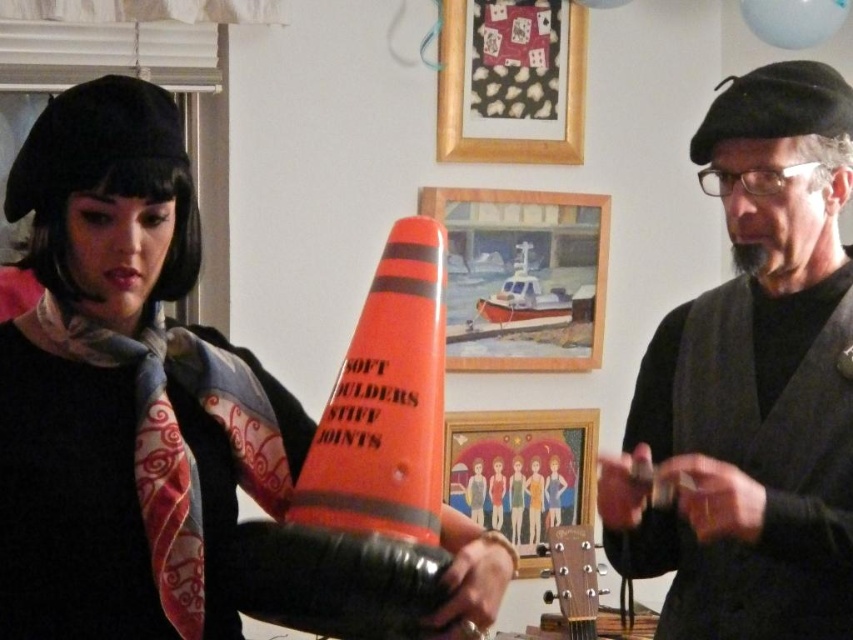
What is located at the coordinates point (386, 403)?

The orange reflective cone at center is located at point (386, 403).

You are standing in the room and want to see both the orange reflective cone at center and the matte orange cone at center clearly. Which one should you look at first to ensure you can see both without moving your head?

You should look at the orange reflective cone at center first because it is in front of the matte orange cone at center, so by focusing on the one in front, you can still see the one behind without moving your head.